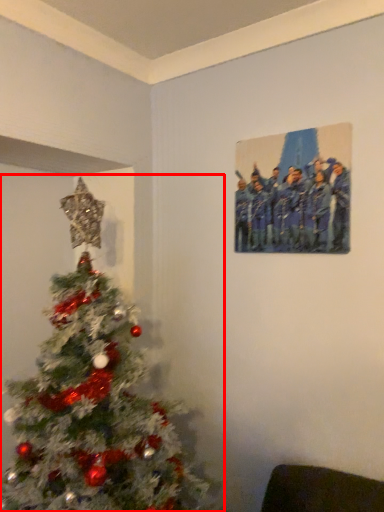
Question: From the image's perspective, where is christmas tree (annotated by the red box) located in relation to picture frame in the image?

Choices:
 (A) below
 (B) above

Answer: (A)